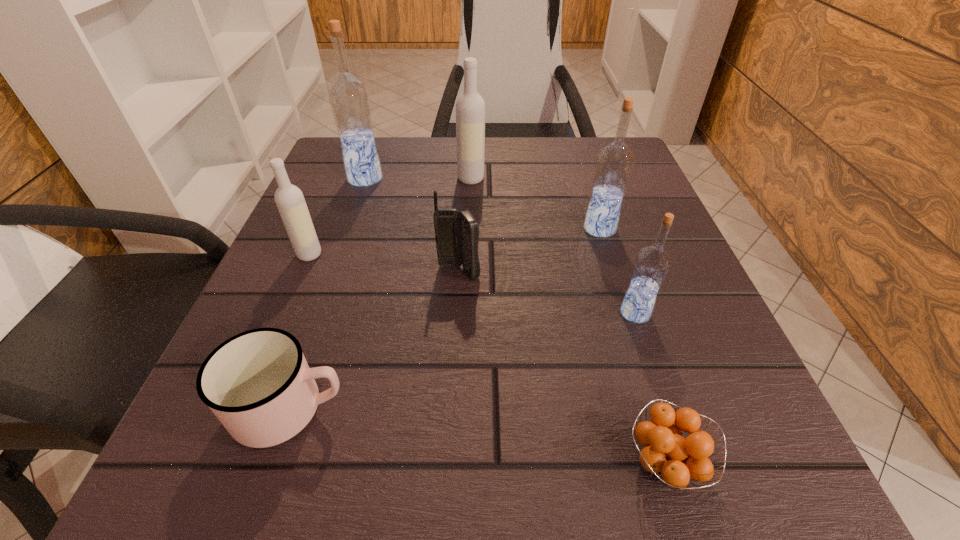
At what (x,y) coordinates should I click in order to perform the action: click on free region located on the side of the second shortest object with the handle. Please return your answer as a coordinate pair (x, y). Looking at the image, I should click on (606, 408).

Identify the location of vacant space located 0.320m on the left of the orange orange fruit. click(x=340, y=463).

Where is `mug that is at the near edge`? Image resolution: width=960 pixels, height=540 pixels. mug that is at the near edge is located at coordinates (258, 384).

The width and height of the screenshot is (960, 540). What are the coordinates of `orange fruit that is at the near edge` in the screenshot? It's located at (673, 459).

At what (x,y) coordinates should I click in order to perform the action: click on mug at the left edge. Please return your answer as a coordinate pair (x, y). Image resolution: width=960 pixels, height=540 pixels. Looking at the image, I should click on (258, 384).

At what (x,y) coordinates should I click in order to perform the action: click on orange fruit that is at the right edge. Please return your answer as a coordinate pair (x, y). This screenshot has height=540, width=960. Looking at the image, I should click on (673, 459).

At what (x,y) coordinates should I click in order to perform the action: click on object positioned at the far left corner. Please return your answer as a coordinate pair (x, y). Looking at the image, I should click on (349, 99).

You are a GUI agent. You are given a task and a screenshot of the screen. Output one action in this format:
    pyautogui.click(x=<x>, y=<y>)
    Task: Click on the object present at the near left corner
    The height and width of the screenshot is (540, 960).
    Given the screenshot: What is the action you would take?
    pyautogui.click(x=258, y=384)

Where is `object situated at the near right corner`? object situated at the near right corner is located at coordinates (673, 459).

Image resolution: width=960 pixels, height=540 pixels. In order to click on vacant area at the far edge of the desktop in this screenshot , I will do `click(532, 179)`.